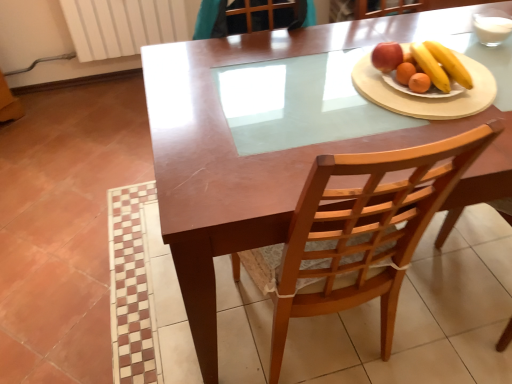
Find the location of a particular element. free space to the right of wooden chair at center is located at coordinates (431, 324).